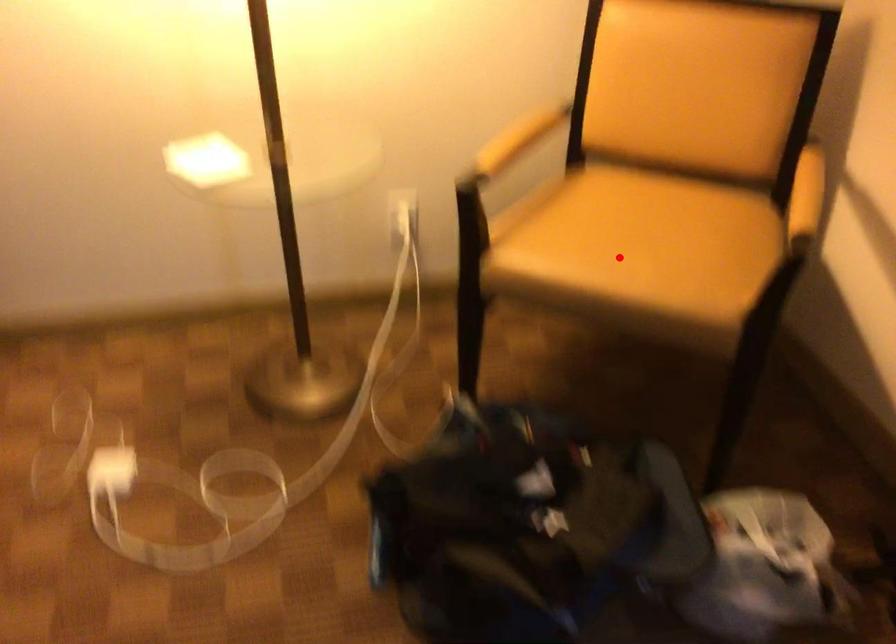
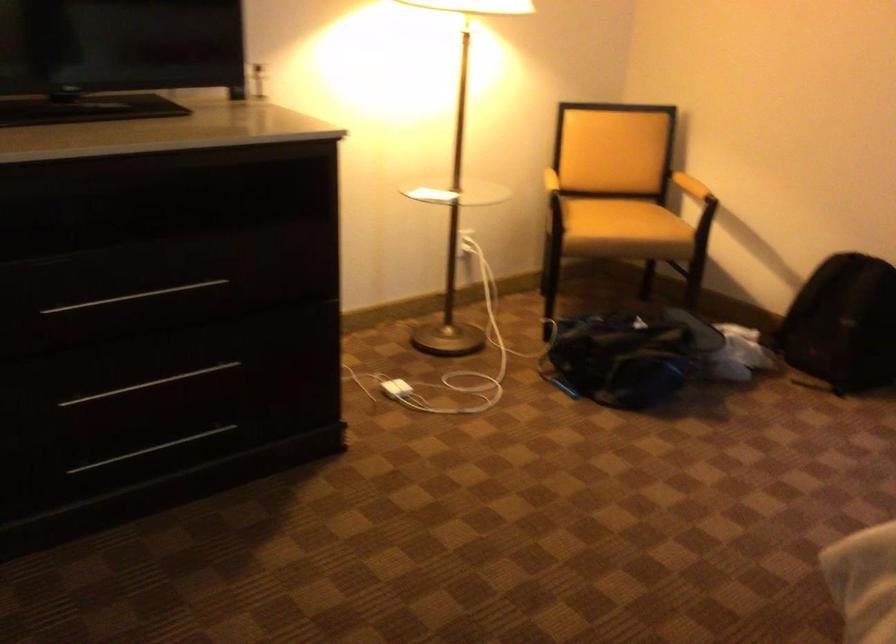
In the second image, find the point that corresponds to the highlighted location in the first image.

(623, 220)